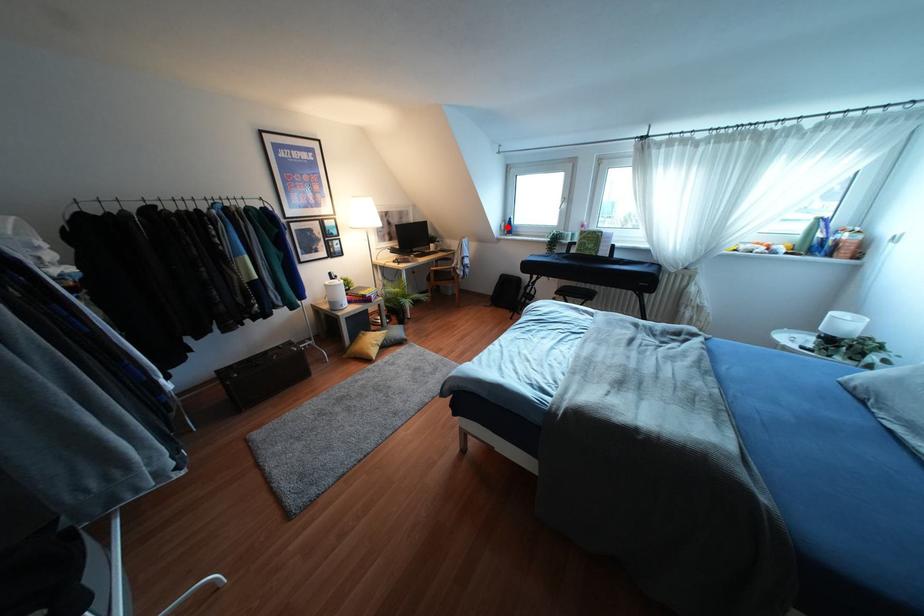
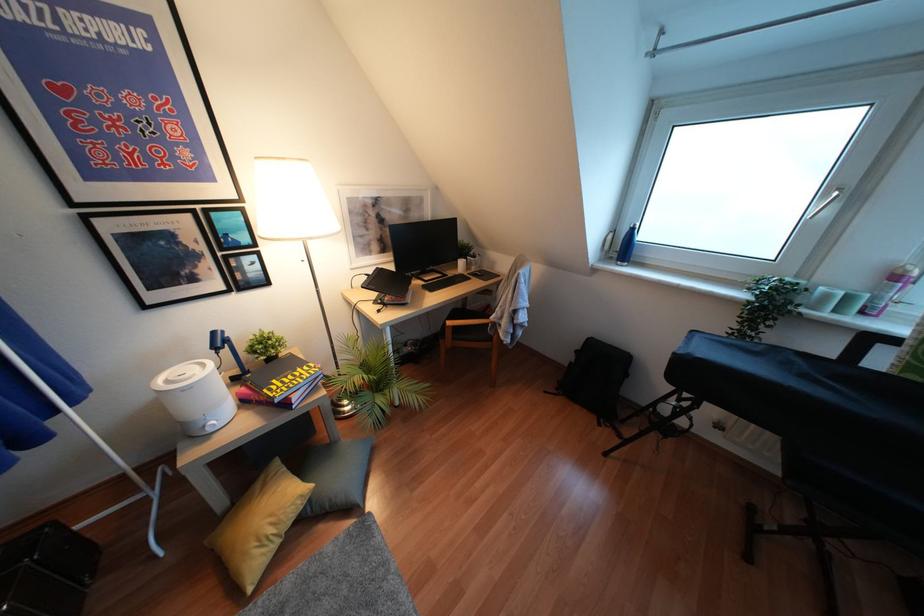
Find the pixel in the second image that matches the highlighted location in the first image.

(623, 246)